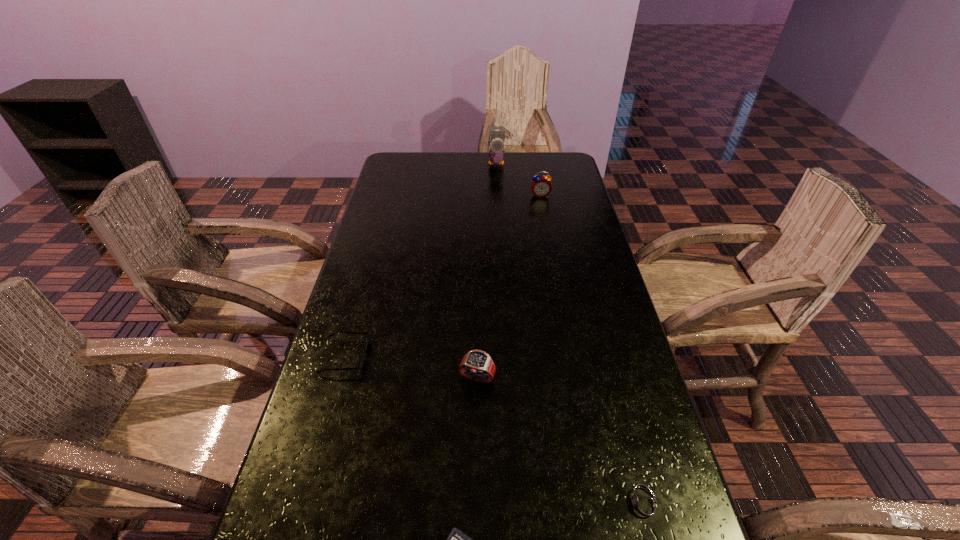
At what (x,y) coordinates should I click in order to perform the action: click on free space located 0.390m at the beak of the tallest object. Please return your answer as a coordinate pair (x, y). The height and width of the screenshot is (540, 960). Looking at the image, I should click on (500, 229).

Identify the location of free space located on the front-facing side of the second tallest object. (554, 268).

Find the location of a particular element. The width and height of the screenshot is (960, 540). free space located 0.290m on the right of the taller watch is located at coordinates (617, 378).

The image size is (960, 540). What are the coordinates of `free location located 0.090m on the front-facing side of the sunglasses` in the screenshot? It's located at (401, 356).

Locate an element on the screen. The height and width of the screenshot is (540, 960). vacant space located on the face of the nearer watch is located at coordinates (537, 505).

The image size is (960, 540). I want to click on blank space located 0.340m on the face of the nearer watch, so click(437, 505).

You are a GUI agent. You are given a task and a screenshot of the screen. Output one action in this format:
    pyautogui.click(x=<x>, y=<y>)
    Task: Click on the vacant area located 0.380m on the face of the nearer watch
    This screenshot has width=960, height=540.
    Given the screenshot: What is the action you would take?
    pyautogui.click(x=416, y=505)

What are the coordinates of `object present at the far edge` in the screenshot? It's located at (496, 153).

Locate an element on the screen. This screenshot has width=960, height=540. object that is at the left edge is located at coordinates (361, 361).

This screenshot has width=960, height=540. Identify the location of alarm clock present at the right edge. (541, 186).